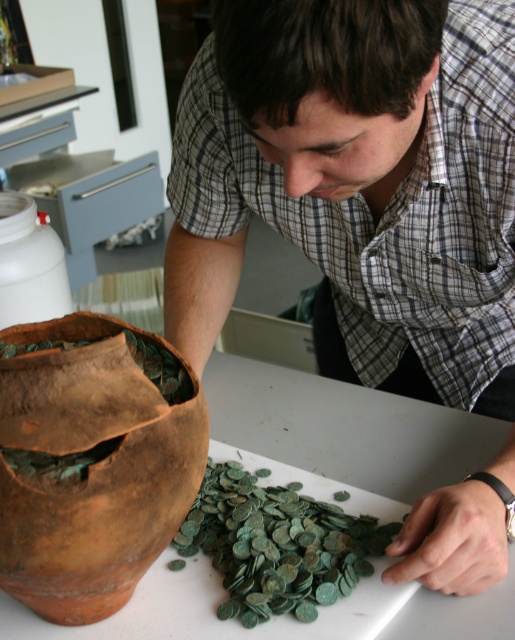
How far apart are brown clay vase at lower left and white plastic bottle at left?

brown clay vase at lower left is 17.81 inches away from white plastic bottle at left.

The height and width of the screenshot is (640, 515). What do you see at coordinates (92, 461) in the screenshot?
I see `brown clay vase at lower left` at bounding box center [92, 461].

Identify the location of brown clay vase at lower left. Image resolution: width=515 pixels, height=640 pixels. (92, 461).

Does brown clay vase at lower left have a lesser height compared to green patinated coins at center?

No.

Who is positioned more to the right, brown clay vase at lower left or green patinated coins at center?

From the viewer's perspective, green patinated coins at center appears more on the right side.

This screenshot has height=640, width=515. I want to click on brown clay vase at lower left, so click(92, 461).

Is matte brown vase at left wider than white plastic bottle at left?

Correct, the width of matte brown vase at left exceeds that of white plastic bottle at left.

Measure the distance between matte brown vase at left and camera.

They are 15.73 inches apart.

Is point (404, 563) behind point (24, 236)?

No, it is not.

At what (x,y) coordinates should I click in order to perform the action: click on matte brown vase at left. Please return your answer as a coordinate pair (x, y). Image resolution: width=515 pixels, height=640 pixels. Looking at the image, I should click on (357, 182).